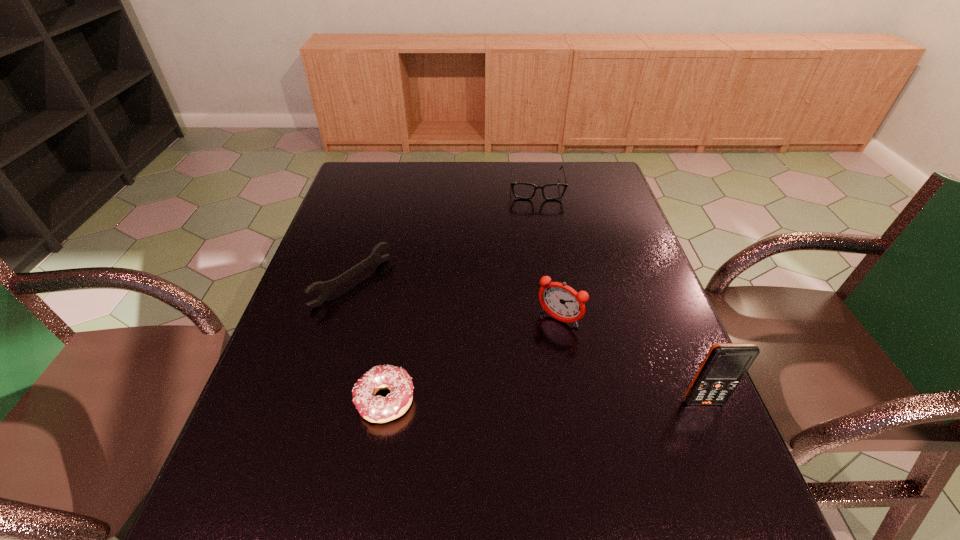
I want to click on vacant space in between the second tallest object and the doughnut, so click(472, 360).

Where is `vacant area between the doughnut and the tallest object`? Image resolution: width=960 pixels, height=540 pixels. vacant area between the doughnut and the tallest object is located at coordinates (544, 401).

Image resolution: width=960 pixels, height=540 pixels. I want to click on free spot between the doughnut and the farthest object, so click(461, 294).

Locate an element on the screen. Image resolution: width=960 pixels, height=540 pixels. vacant space that's between the alarm clock and the farthest object is located at coordinates (547, 253).

Identify which object is located as the third nearest to the fourth shortest object. Please provide its 2D coordinates. Your answer should be formatted as a tuple, i.e. [(x, y)], where the tuple contains the x and y coordinates of a point satisfying the conditions above.

[(326, 288)]

Select which object appears as the third closest to the farthest object. Please provide its 2D coordinates. Your answer should be formatted as a tuple, i.e. [(x, y)], where the tuple contains the x and y coordinates of a point satisfying the conditions above.

[(377, 409)]

The height and width of the screenshot is (540, 960). Identify the location of free location that satisfies the following two spatial constraints: 1. on the front side of the wrench; 2. on the left side of the doughnut. (317, 401).

Identify the location of vacant area in the image that satisfies the following two spatial constraints: 1. on the back side of the spectacles; 2. on the left side of the wrench. coord(382,187).

The image size is (960, 540). I want to click on free space that satisfies the following two spatial constraints: 1. on the back side of the farthest object; 2. on the right side of the doughnut, so click(423, 187).

Identify the location of free location that satisfies the following two spatial constraints: 1. on the front side of the fourth shortest object; 2. on the right side of the wrench. This screenshot has width=960, height=540. (341, 320).